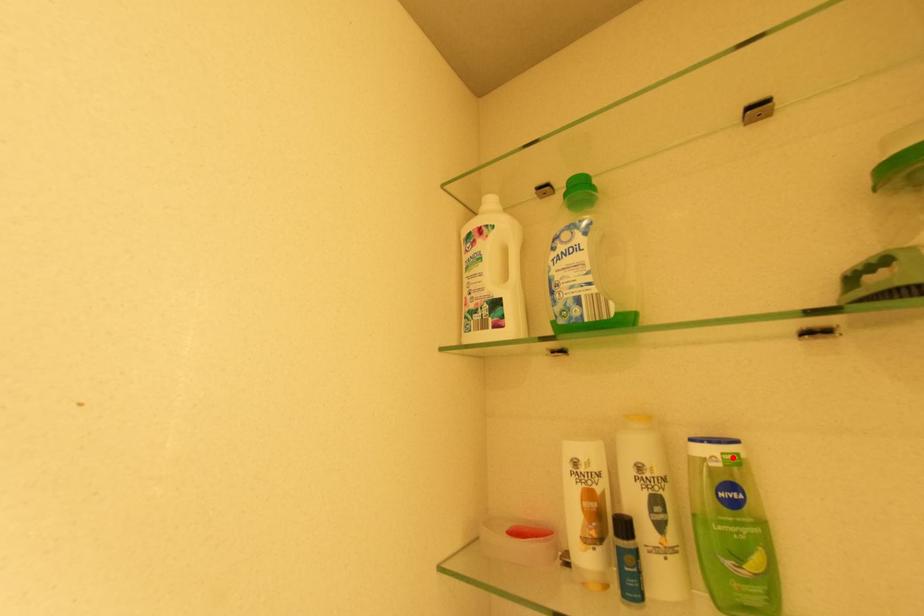
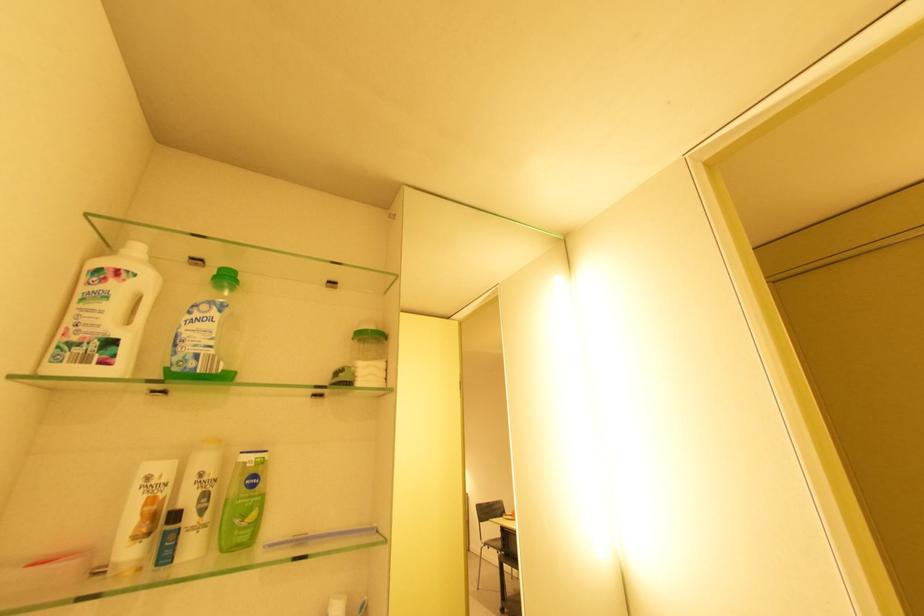
Question: I am providing you with two images of the same scene from different viewpoints. A red point is marked on the first image. Is the red point's position out of view in image 2?

Choices:
 (A) Yes
 (B) No

Answer: (B)